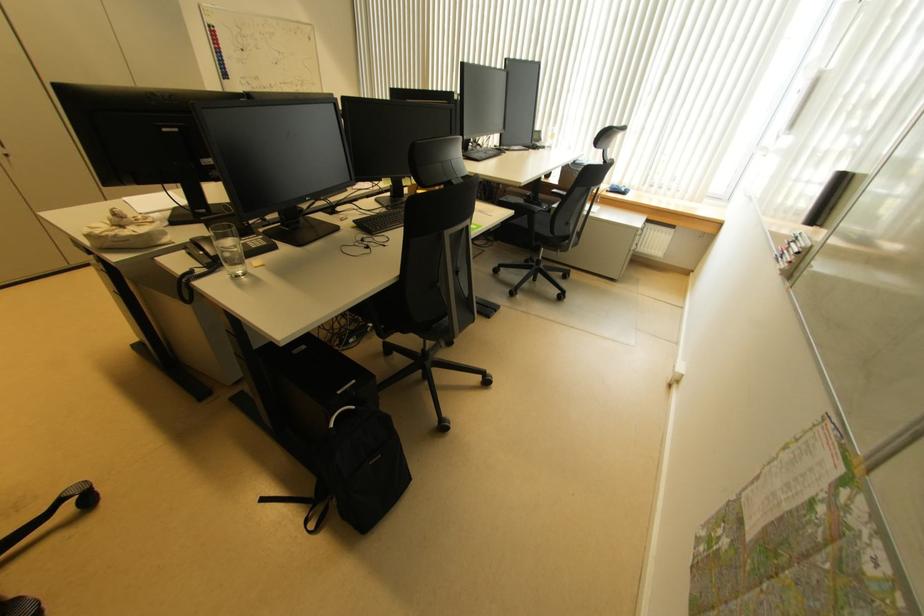
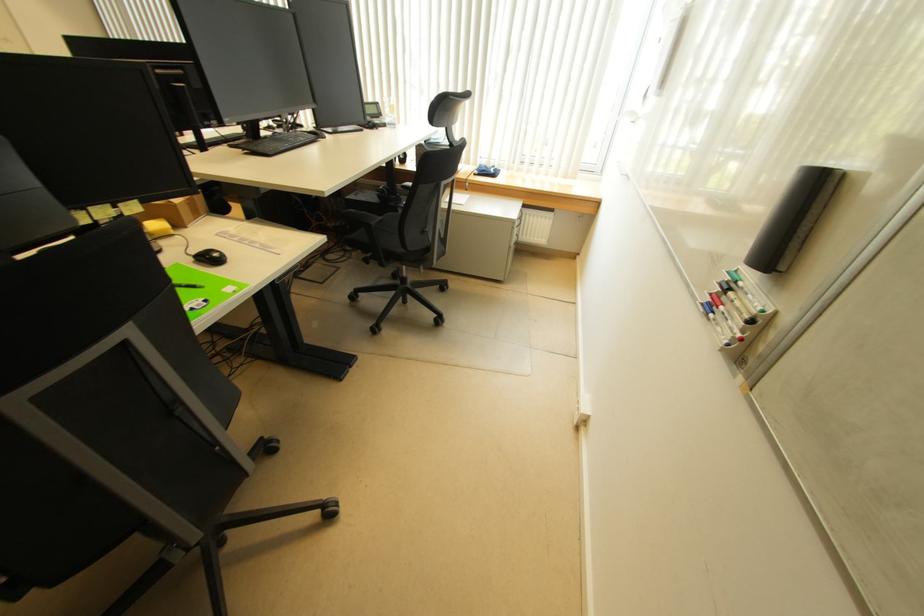
Where in the second image is the point corresponding to pixel 801 241 from the first image?

(743, 286)